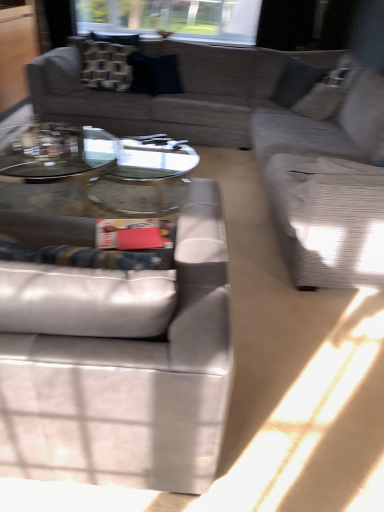
Question: Considering the positions of clear glass coffee table at center and patterned fabric pillow at upper left, acting as the first pillow starting from the left, in the image, is clear glass coffee table at center taller or shorter than patterned fabric pillow at upper left, acting as the first pillow starting from the left,?

Choices:
 (A) tall
 (B) short

Answer: (B)

Question: From a real-world perspective, relative to patterned fabric pillow at upper left, acting as the first pillow starting from the left, is clear glass coffee table at center vertically above or below?

Choices:
 (A) above
 (B) below

Answer: (B)

Question: Which is nearer to the textured gray couch at upper center, which is the 1th studio couch in top-to-bottom order?

Choices:
 (A) leather couch at lower left, positioned as the second studio couch in back-to-front order
 (B) clear glass coffee table at center
 (C) patterned fabric pillow at upper left, acting as the first pillow starting from the left
 (D) transparent glass window at upper center
 (E) velvet dark blue pillow at center, acting as the second pillow starting from the left

Answer: (B)

Question: Which of these objects is positioned farthest from the transparent glass window at upper center?

Choices:
 (A) textured gray couch at right
 (B) clear glass coffee table at center
 (C) leather couch at lower left, positioned as the second studio couch in back-to-front order
 (D) textured gray couch at upper center, the second studio couch positioned from the front
 (E) velvet dark blue pillow at center, acting as the second pillow starting from the left

Answer: (C)